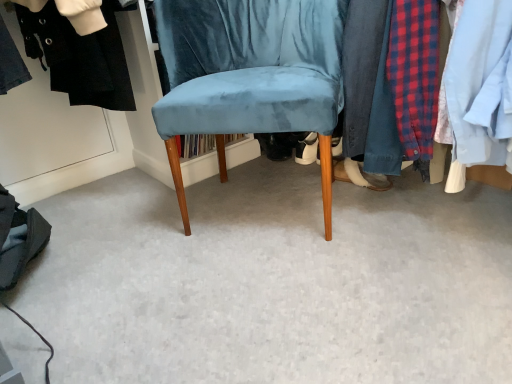
This screenshot has height=384, width=512. Identify the location of blank area beneath velvet blue chair at center (from a real-world perspective). (270, 204).